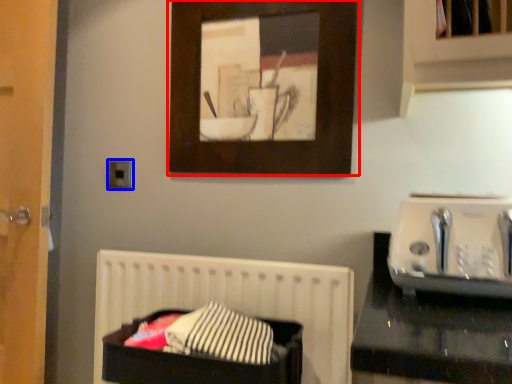
Question: Among these objects, which one is farthest to the camera, picture frame (highlighted by a red box) or electric outlet (highlighted by a blue box)?

Choices:
 (A) picture frame
 (B) electric outlet

Answer: (B)